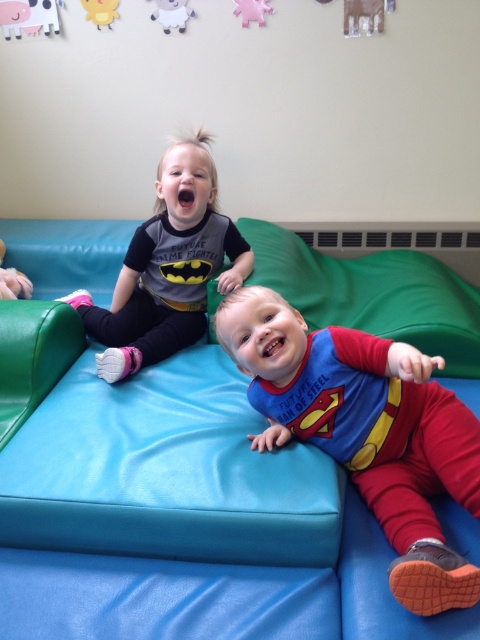
You are a parent trying to organize your kids clothing. You have a superman costume at center and a matte black shirt at upper left. Which item is closer to the washing machine located at the bottom of the image?

The superman costume at center is closer to the washing machine located at the bottom of the image because it is only 24.86 inches away from the matte black shirt at upper left, which is farther away.

From the picture: You are a photographer trying to capture a closeup of the child on the left. You notice two points in the scene at coordinates point (x=83, y=1) and point (x=239, y=10). Which point should you focus on to ensure the child on the left is in focus?

You should focus on point (x=83, y=1) because it is closer to the camera than point (x=239, y=10), ensuring the child on the left is in focus.